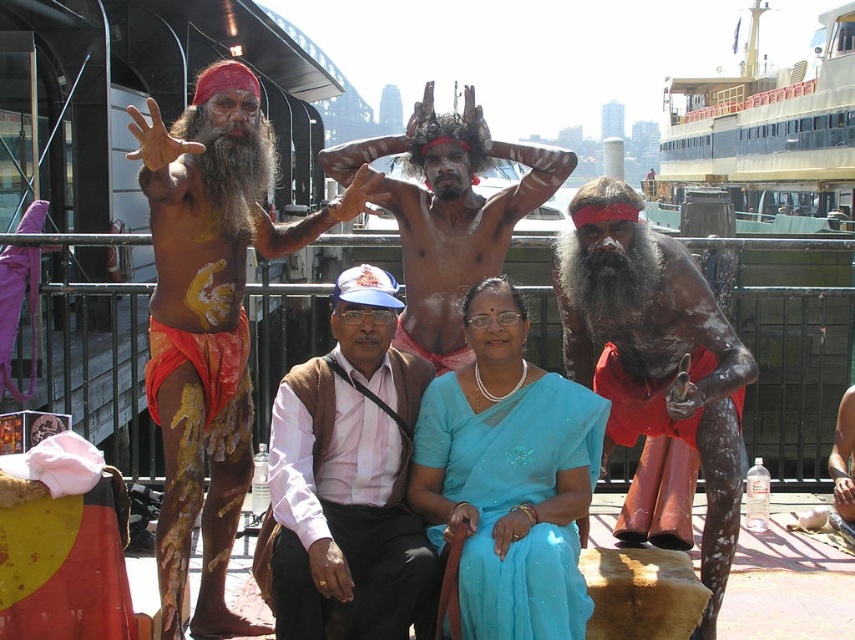
You are a photographer trying to capture a clear shot of the matte black body paint at center without the matte red shorts at left blocking it. Based on the scene, can you position yourself in a way to avoid the shorts blocking the view?

The matte red shorts at left is in front of the matte black body paint at center, so you need to move to a position where you can see around or behind the shorts to capture the body paint without obstruction.

Looking at this image, you are organizing a cultural event and need to decide which fabric to use for a large banner. The banner requires a fabric that is wider. Based on the scene, which fabric should you choose between the light pink fabric at center and the blue silk saree at center?

The blue silk saree at center should be chosen because its width is greater than the light pink fabric at center.

You are an architect designing a new building. You need to ensure that the light pink fabric at center does not block the view of the yellow painted steel ferry at upper right. Based on their heights, is this possible?

The light pink fabric at center is not as tall as the yellow painted steel ferry at upper right, so it is possible to design the building in a way that the ferry remains visible without obstruction from the fabric.